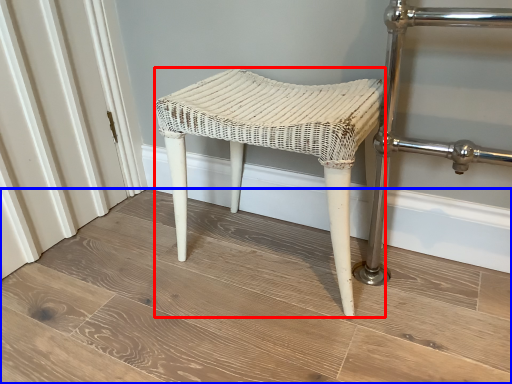
Question: Which point is further to the camera, stool (highlighted by a red box) or plank (highlighted by a blue box)?

Choices:
 (A) stool
 (B) plank

Answer: (A)